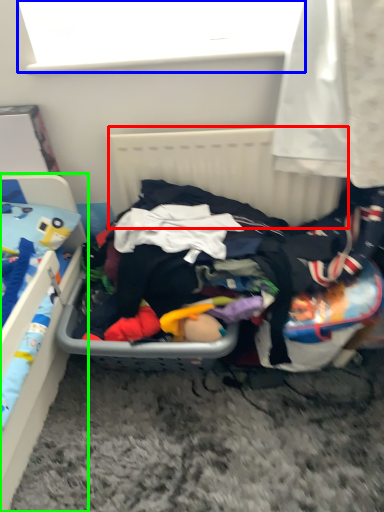
Question: Which is farther away from radiator (highlighted by a red box)? window screen (highlighted by a blue box) or furniture (highlighted by a green box)?

Choices:
 (A) window screen
 (B) furniture

Answer: (B)